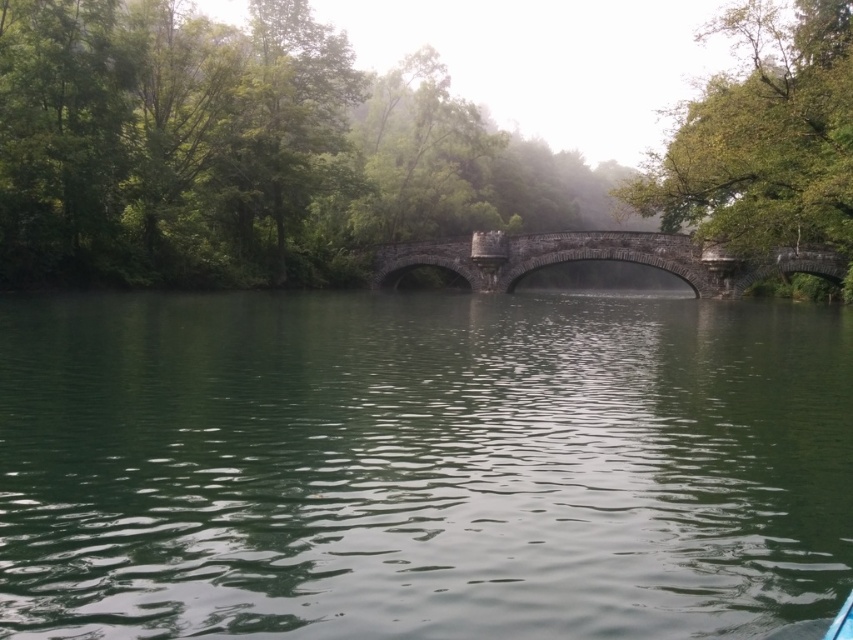
Question: Can you confirm if green leafy tree at center is positioned above green leafy tree at upper right?

Choices:
 (A) yes
 (B) no

Answer: (A)

Question: Can you confirm if green leafy tree at center is bigger than green leafy tree at upper right?

Choices:
 (A) yes
 (B) no

Answer: (A)

Question: Which point is farther from the camera taking this photo?

Choices:
 (A) (698, 280)
 (B) (496, 502)
 (C) (780, 228)

Answer: (A)

Question: Estimate the real-world distances between objects in this image. Which object is farther from the dark gray stone bridge at center?

Choices:
 (A) green leafy tree at center
 (B) green smooth water at center
 (C) green leafy tree at upper right

Answer: (B)

Question: Can you confirm if green leafy tree at center is bigger than green leafy tree at upper right?

Choices:
 (A) no
 (B) yes

Answer: (B)

Question: Which point is closer to the camera?

Choices:
 (A) (144, 548)
 (B) (815, 250)
 (C) (699, 173)
 (D) (438, 228)

Answer: (A)